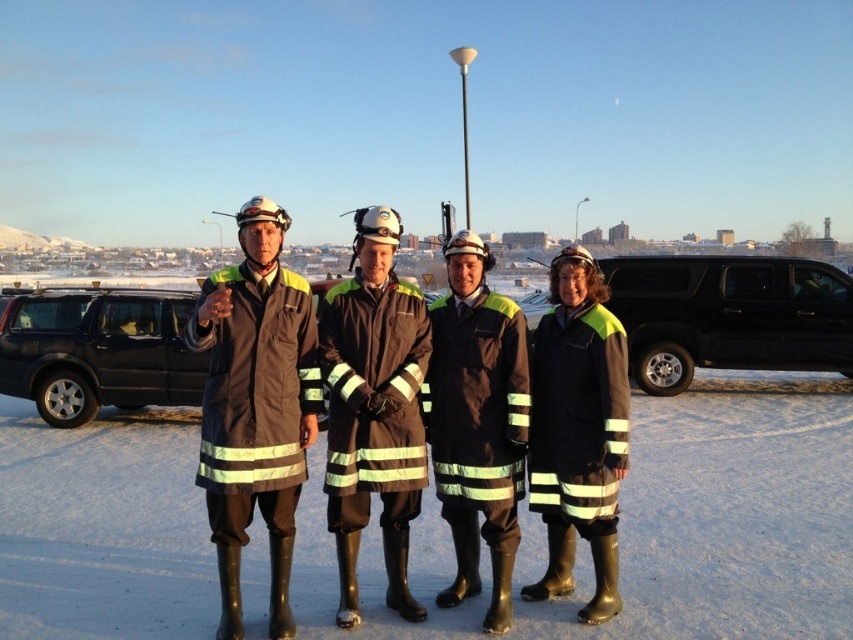
Does black rubber suv at right have a greater height compared to black matte uniform at center?

Correct, black rubber suv at right is much taller as black matte uniform at center.

Who is taller, black rubber suv at right or black matte uniform at center?

black rubber suv at right

Who is more distant from viewer, (660, 387) or (437, 301)?

Point (660, 387)

This screenshot has height=640, width=853. Find the location of `black rubber suv at right`. black rubber suv at right is located at coordinates (728, 316).

Who is shorter, dark gray fabric coat at left or black rubber suv at right?

black rubber suv at right is shorter.

Does dark gray fabric coat at left have a larger size compared to black rubber suv at right?

Actually, dark gray fabric coat at left might be smaller than black rubber suv at right.

The width and height of the screenshot is (853, 640). Describe the element at coordinates (254, 406) in the screenshot. I see `dark gray fabric coat at left` at that location.

The image size is (853, 640). In order to click on dark gray fabric coat at left in this screenshot , I will do `click(254, 406)`.

Looking at this image, can you confirm if black rubber suv at right is shorter than black matte suv at left?

No, black rubber suv at right is not shorter than black matte suv at left.

This screenshot has height=640, width=853. What are the coordinates of `black rubber suv at right` in the screenshot? It's located at (728, 316).

The height and width of the screenshot is (640, 853). What do you see at coordinates (728, 316) in the screenshot? I see `black rubber suv at right` at bounding box center [728, 316].

The height and width of the screenshot is (640, 853). I want to click on black rubber suv at right, so click(728, 316).